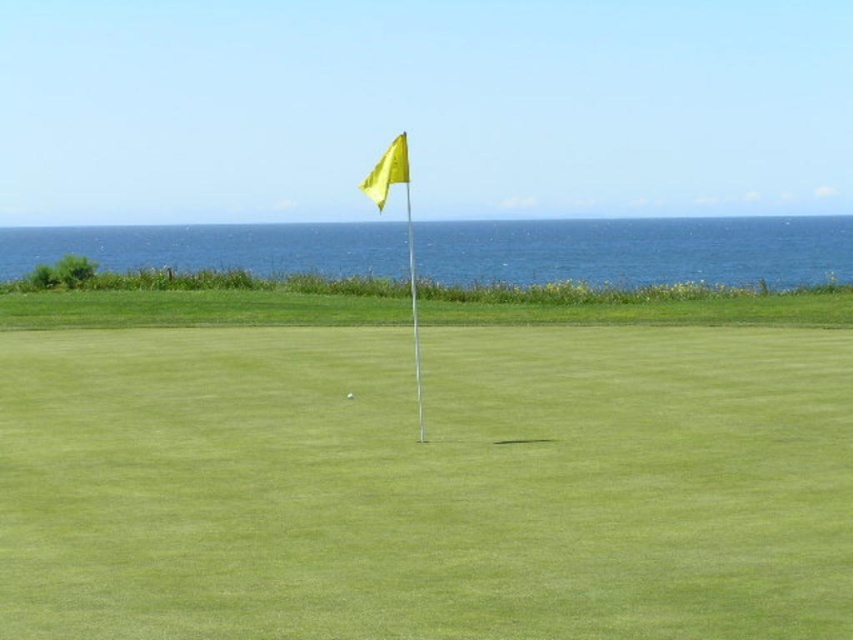
Question: Can you confirm if yellow fabric flag at center is smaller than blue water at upper center?

Choices:
 (A) no
 (B) yes

Answer: (B)

Question: Which is farther from the yellow fabric flag at center?

Choices:
 (A) white matte golf at center
 (B) blue water at upper center

Answer: (B)

Question: Where is yellow fabric flag at center located in relation to blue water at upper center in the image?

Choices:
 (A) above
 (B) below

Answer: (B)

Question: Which of the following is the farthest from the observer?

Choices:
 (A) blue water at upper center
 (B) white matte golf at center

Answer: (A)

Question: In this image, where is yellow fabric flag at center located relative to blue water at upper center?

Choices:
 (A) above
 (B) below

Answer: (B)

Question: Which of the following is the closest to the observer?

Choices:
 (A) (349, 397)
 (B) (122, 483)

Answer: (B)